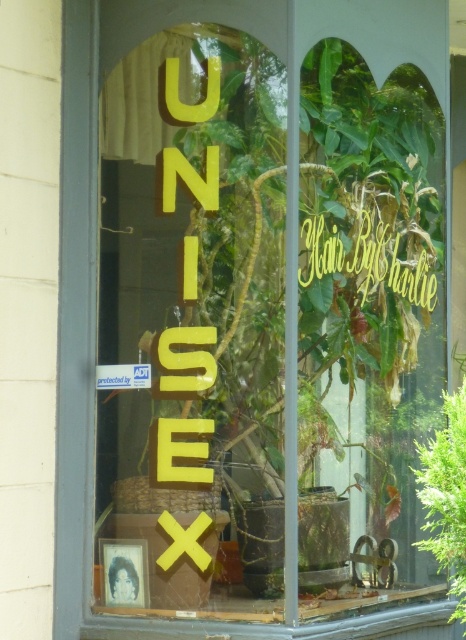
Consider the image. You are a customer looking at the shop window. You see the green leafy plant at right and the yellow metallic sign at center. Which object is nearer to you?

The green leafy plant at right is closer to the viewer than the yellow metallic sign at center.

You are standing in front of the shop window and want to place a small decorative item on the wooden surface where the framed photograph is located. Considering the green leafy plant at right, where should you place the item to ensure it doesn not block the view of the photograph?

The green leafy plant at right is located at point (445, 496), so place the item away from that position to avoid blocking the view of the framed photograph.

You are a window designer who wants to ensure all items in the display are visible. Given that the green leafy plant at right and the yellow metallic sign at center are both important elements, which one should you adjust in size to make sure they are both clearly visible without overlapping?

Since the green leafy plant at right is narrower than the yellow metallic sign at center, you should consider enlarging the green leafy plant at right to match the width of the yellow metallic sign at center, ensuring both elements are balanced and visible in the display.